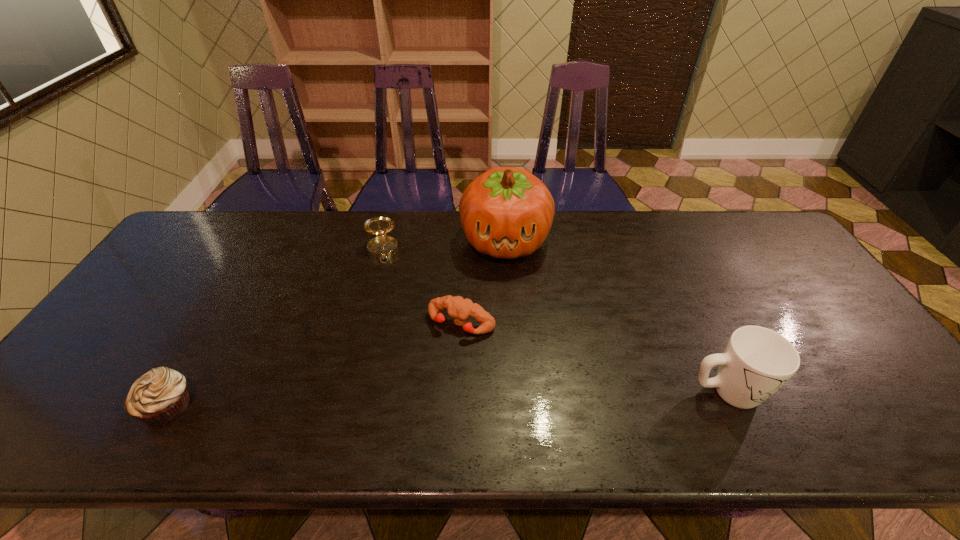
I want to click on free spot located 0.150m on the side of the fourth shortest object with the handle, so click(829, 391).

Find the location of `vacant space located 0.140m with the gloves of the shortest object facing forward`. vacant space located 0.140m with the gloves of the shortest object facing forward is located at coordinates (421, 382).

At what (x,y) coordinates should I click in order to perform the action: click on blank space located 0.060m with the gloves of the shortest object facing forward. Please return your answer as a coordinate pair (x, y). The width and height of the screenshot is (960, 540). Looking at the image, I should click on (437, 356).

Where is `vacant space located with the gloves of the shortest object facing forward`? This screenshot has width=960, height=540. vacant space located with the gloves of the shortest object facing forward is located at coordinates (407, 406).

The height and width of the screenshot is (540, 960). I want to click on free point located 0.080m with the dial facing the third tallest object, so click(x=384, y=280).

Find the location of a particular element. blank space located 0.280m with the dial facing the third tallest object is located at coordinates (389, 331).

Image resolution: width=960 pixels, height=540 pixels. Identify the location of vacant region located with the dial facing the third tallest object. (387, 307).

What are the coordinates of `vacant position located 0.190m on the side of the tallest object with the cute face` in the screenshot? It's located at (501, 318).

Find the location of `free point located 0.060m on the side of the tallest object with the cute face`. free point located 0.060m on the side of the tallest object with the cute face is located at coordinates (503, 285).

The width and height of the screenshot is (960, 540). I want to click on free space located on the side of the tallest object with the cute face, so click(x=499, y=367).